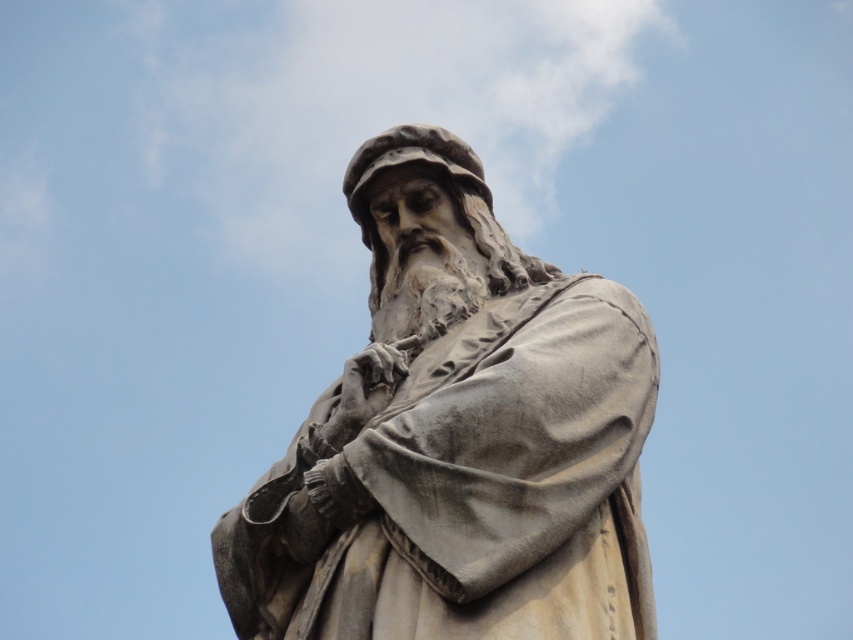
Question: Is gray stone statue at center above white fluffy cloud at upper center?

Choices:
 (A) no
 (B) yes

Answer: (A)

Question: Which point is farther to the camera?

Choices:
 (A) gray stone statue at center
 (B) white fluffy cloud at upper center

Answer: (B)

Question: Does gray stone statue at center appear on the right side of white fluffy cloud at upper center?

Choices:
 (A) yes
 (B) no

Answer: (A)

Question: Is gray stone statue at center bigger than white fluffy cloud at upper center?

Choices:
 (A) yes
 (B) no

Answer: (B)

Question: Which of the following is the closest to the observer?

Choices:
 (A) white fluffy cloud at upper center
 (B) gray stone statue at center

Answer: (B)